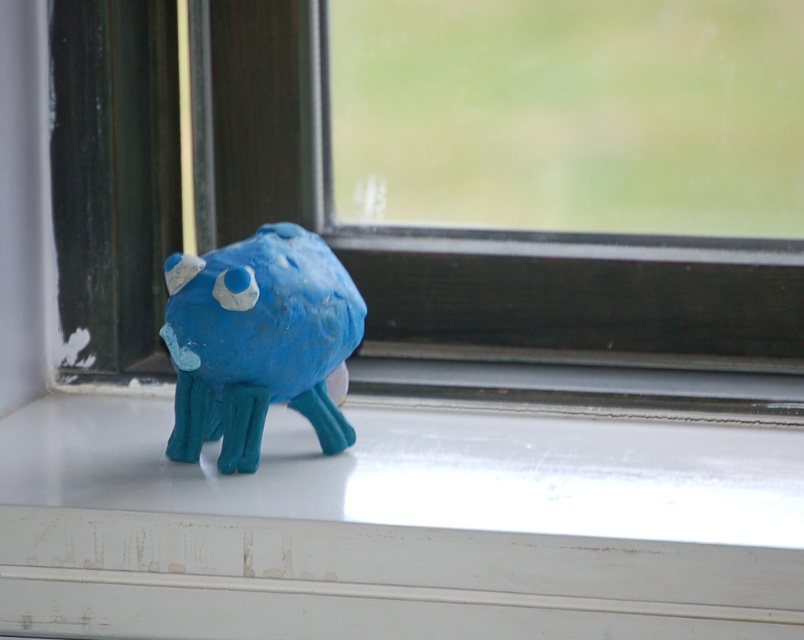
You are an interior designer looking at the windowsill where the small, handmade clay sculpture is placed. You want to place a decorative plant pot exactly at the point marked as point (398, 525). Based on the scene description, where should you place the plant pot relative to the sculpture?

The white painted wood at center is located at point (398, 525). Therefore, you should place the decorative plant pot at the white painted wood at center, which is the central area of the windowsill where the sculpture is positioned.

You are looking at the windowsill where the white painted wood at center and matte clay monster at center are located. Which object is positioned to the right of the other?

The white painted wood at center is positioned to the right of the matte clay monster at center.

You are standing in front of the windowsill and want to place a small plant to the left of the matte black window frame at center. Can you place it to the left of the matte clay monster at center instead?

The matte black window frame at center is to the right of the matte clay monster at center, so placing the plant to the left of the matte black window frame at center would also place it to the left of the matte clay monster at center.